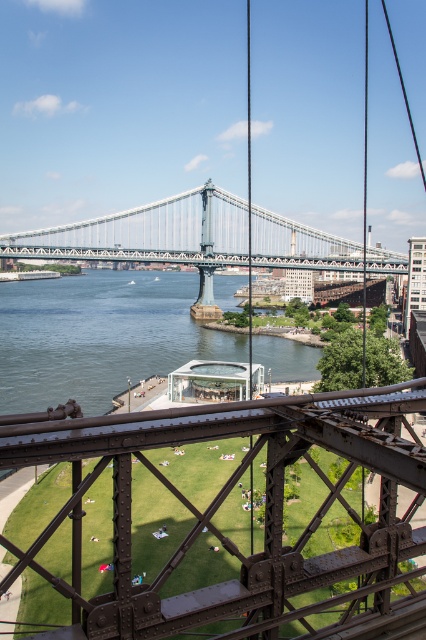
Question: Can you confirm if green grass lawn at center is smaller than metallic steel bridge at center?

Choices:
 (A) yes
 (B) no

Answer: (A)

Question: Is green grass lawn at center to the right of metallic steel bridge at center from the viewer's perspective?

Choices:
 (A) no
 (B) yes

Answer: (A)

Question: Is green grass lawn at center further to camera compared to metallic steel bridge at center?

Choices:
 (A) yes
 (B) no

Answer: (B)

Question: Which point appears farthest from the camera in this image?

Choices:
 (A) (172, 602)
 (B) (138, 220)

Answer: (B)

Question: Which point is farther from the camera taking this photo?

Choices:
 (A) (250, 632)
 (B) (368, 268)

Answer: (B)